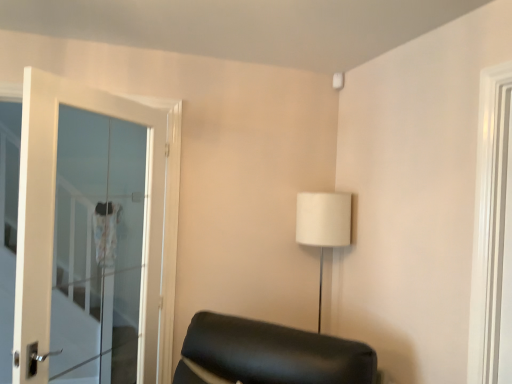
Question: Is white glossy door at right inside or outside of white fabric lampshade at upper right?

Choices:
 (A) outside
 (B) inside

Answer: (A)

Question: Considering the positions of white glossy door at right and white fabric lampshade at upper right in the image, is white glossy door at right taller or shorter than white fabric lampshade at upper right?

Choices:
 (A) short
 (B) tall

Answer: (B)

Question: Which object is positioned farthest from the white glass door at left?

Choices:
 (A) white fabric lampshade at upper right
 (B) white glossy door at right

Answer: (B)

Question: Estimate the real-world distances between objects in this image. Which object is farther from the white fabric lampshade at upper right?

Choices:
 (A) white glass door at left
 (B) white glossy door at right

Answer: (A)